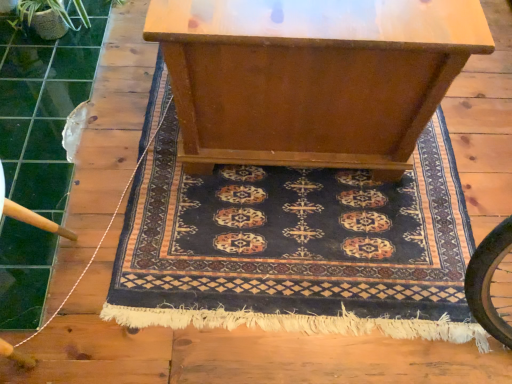
Question: Does white string at left come in front of dark blue woven rug at center?

Choices:
 (A) yes
 (B) no

Answer: (A)

Question: From the image's perspective, is white string at left located beneath dark blue woven rug at center?

Choices:
 (A) yes
 (B) no

Answer: (B)

Question: From a real-world perspective, is white string at left located higher than dark blue woven rug at center?

Choices:
 (A) no
 (B) yes

Answer: (B)

Question: From a real-world perspective, is white string at left beneath dark blue woven rug at center?

Choices:
 (A) no
 (B) yes

Answer: (A)

Question: Is dark blue woven rug at center at the back of white string at left?

Choices:
 (A) no
 (B) yes

Answer: (A)

Question: Does white string at left turn towards dark blue woven rug at center?

Choices:
 (A) no
 (B) yes

Answer: (B)

Question: Is dark blue woven rug at center positioned with its back to white string at left?

Choices:
 (A) no
 (B) yes

Answer: (B)

Question: Does dark blue woven rug at center have a lesser width compared to white string at left?

Choices:
 (A) yes
 (B) no

Answer: (B)

Question: Is dark blue woven rug at center wider than white string at left?

Choices:
 (A) no
 (B) yes

Answer: (B)

Question: Is dark blue woven rug at center bigger than white string at left?

Choices:
 (A) yes
 (B) no

Answer: (A)

Question: Does dark blue woven rug at center have a smaller size compared to white string at left?

Choices:
 (A) yes
 (B) no

Answer: (B)

Question: Is dark blue woven rug at center shorter than white string at left?

Choices:
 (A) no
 (B) yes

Answer: (B)

Question: Is dark blue woven rug at center positioned before wooden table at center?

Choices:
 (A) yes
 (B) no

Answer: (B)